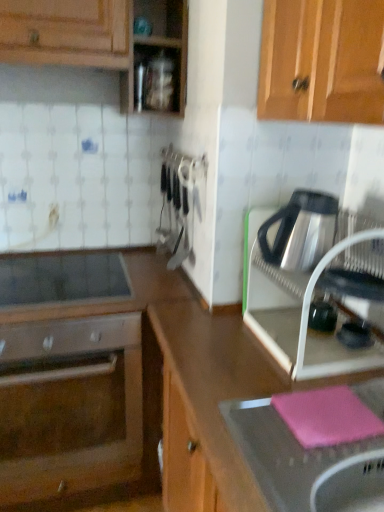
You are a GUI agent. You are given a task and a screenshot of the screen. Output one action in this format:
    pyautogui.click(x=<x>, y=<y>)
    Task: Click on the vacant space underneath smooth glass cooktop at center-left (from a real-world perspective)
    The height and width of the screenshot is (512, 384).
    Given the screenshot: What is the action you would take?
    pyautogui.click(x=59, y=280)